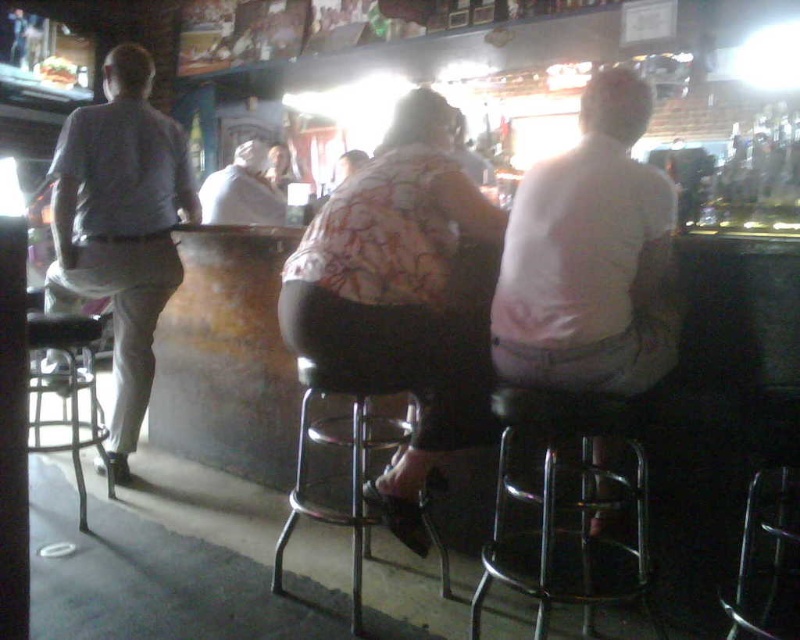
You are a bartender at the bar counter. You need to hand a drink to the person in the light gray fabric shirt at left. The bar counter is 1.2 meters wide. Can you reach them from your current position behind the counter?

The light gray fabric shirt at left is 2.52 meters away from you. Since the bar counter is only 1.2 meters wide, you cannot reach them as the distance exceeds the counter width.